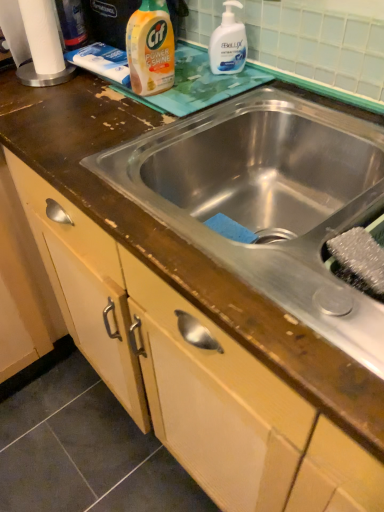
Question: From the image's perspective, is white glossy hand soap at upper right, the first cleaning product when ordered from right to left, located above or below yellow plastic bottle at upper center, the 2th cleaning product positioned from the right?

Choices:
 (A) below
 (B) above

Answer: (B)

Question: Considering the positions of point (235, 40) and point (165, 48), is point (235, 40) closer or farther from the camera than point (165, 48)?

Choices:
 (A) closer
 (B) farther

Answer: (B)

Question: Which object is positioned farthest from the white paper towel at upper left?

Choices:
 (A) stainless steel sink at center
 (B) white glossy hand soap at upper right, the first cleaning product when ordered from right to left
 (C) yellow plastic bottle at upper center, the 2th cleaning product positioned from the right

Answer: (A)

Question: Estimate the real-world distances between objects in this image. Which object is farther from the stainless steel sink at center?

Choices:
 (A) white paper towel at upper left
 (B) yellow plastic bottle at upper center, the 2th cleaning product positioned from the right
 (C) white glossy hand soap at upper right, the first cleaning product when ordered from right to left

Answer: (A)